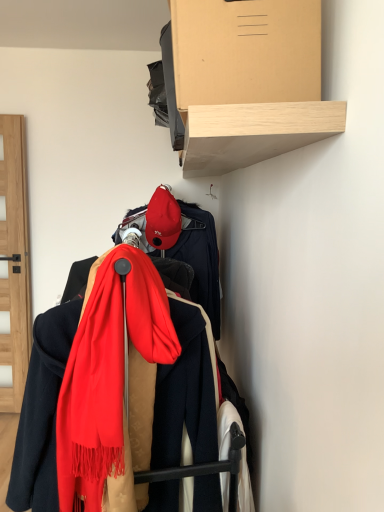
Question: Does red soft scarf at center have a lesser height compared to light brown wooden shelf at upper center?

Choices:
 (A) no
 (B) yes

Answer: (A)

Question: From the image's perspective, is red soft scarf at center over light brown wooden shelf at upper center?

Choices:
 (A) yes
 (B) no

Answer: (B)

Question: Are red soft scarf at center and light brown wooden shelf at upper center making contact?

Choices:
 (A) no
 (B) yes

Answer: (A)

Question: From the image's perspective, does red soft scarf at center appear lower than light brown wooden shelf at upper center?

Choices:
 (A) yes
 (B) no

Answer: (A)

Question: Is red soft scarf at center closer to camera compared to light brown wooden shelf at upper center?

Choices:
 (A) no
 (B) yes

Answer: (A)

Question: From the image's perspective, is red soft scarf at center above or below matte red cap at center?

Choices:
 (A) below
 (B) above

Answer: (A)

Question: In terms of size, does red soft scarf at center appear bigger or smaller than matte red cap at center?

Choices:
 (A) big
 (B) small

Answer: (A)

Question: Is red soft scarf at center in front of or behind matte red cap at center in the image?

Choices:
 (A) front
 (B) behind

Answer: (A)

Question: Is red soft scarf at center taller or shorter than matte red cap at center?

Choices:
 (A) short
 (B) tall

Answer: (B)

Question: In the image, is light brown wooden shelf at upper center positioned in front of or behind matte red cap at center?

Choices:
 (A) behind
 (B) front

Answer: (B)

Question: From the image's perspective, is light brown wooden shelf at upper center located above or below matte red cap at center?

Choices:
 (A) below
 (B) above

Answer: (B)

Question: From a real-world perspective, is light brown wooden shelf at upper center above or below matte red cap at center?

Choices:
 (A) above
 (B) below

Answer: (A)

Question: Based on their positions, is light brown wooden shelf at upper center located to the left or right of matte red cap at center?

Choices:
 (A) right
 (B) left

Answer: (A)

Question: From the image's perspective, is red soft scarf at center above or below light brown wooden shelf at upper center?

Choices:
 (A) below
 (B) above

Answer: (A)

Question: Choose the correct answer: Is red soft scarf at center inside light brown wooden shelf at upper center or outside it?

Choices:
 (A) outside
 (B) inside

Answer: (A)